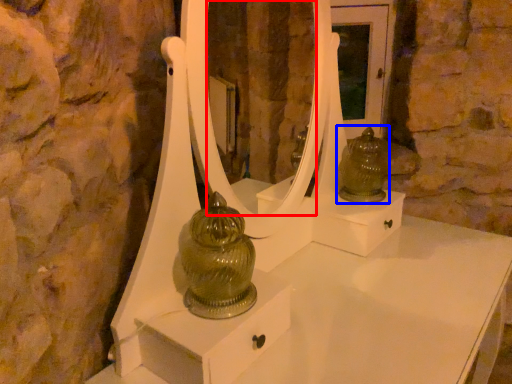
Question: Which object appears farthest to the camera in this image, mirror (highlighted by a red box) or figurine (highlighted by a blue box)?

Choices:
 (A) mirror
 (B) figurine

Answer: (A)